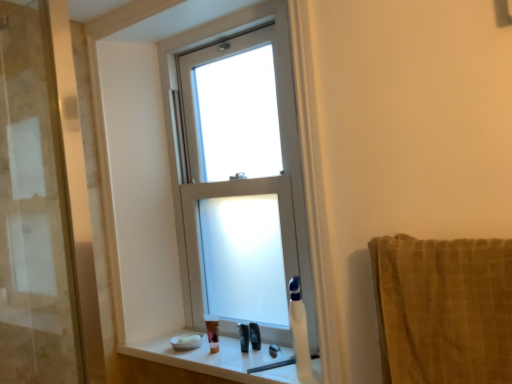
At what (x,y) coordinates should I click in order to perform the action: click on translucent plastic soap at lower center, the 3th toiletry in the right-to-left sequence. Please return your answer as a coordinate pair (x, y). This screenshot has width=512, height=384. Looking at the image, I should click on (212, 331).

Identify the location of white frosted glass window at center. Image resolution: width=512 pixels, height=384 pixels. (240, 184).

Measure the distance between point (243, 289) and camera.

Point (243, 289) is 5.55 feet from camera.

The height and width of the screenshot is (384, 512). Find the location of `brown textured towel at right`. brown textured towel at right is located at coordinates (443, 309).

Describe the element at coordinates (443, 309) in the screenshot. This screenshot has width=512, height=384. I see `brown textured towel at right` at that location.

This screenshot has width=512, height=384. Find the location of `white plastic window frame at center`. white plastic window frame at center is located at coordinates (172, 127).

This screenshot has height=384, width=512. What do you see at coordinates (255, 336) in the screenshot? I see `black plastic razor at lower center, marked as the 1th toiletry in a right-to-left arrangement` at bounding box center [255, 336].

Locate an element on the screen. Image resolution: width=512 pixels, height=384 pixels. white plastic soap dispenser at lower right is located at coordinates (298, 330).

Does white plastic soap dispenser at lower right have a lesser height compared to white frosted glass window at center?

Indeed, white plastic soap dispenser at lower right has a lesser height compared to white frosted glass window at center.

Considering the relative sizes of white plastic soap dispenser at lower right and white frosted glass window at center in the image provided, is white plastic soap dispenser at lower right wider than white frosted glass window at center?

Yes, white plastic soap dispenser at lower right is wider than white frosted glass window at center.

Does white plastic soap dispenser at lower right turn towards white frosted glass window at center?

No, white plastic soap dispenser at lower right is not turned towards white frosted glass window at center.

Where is `window behind the white plastic soap dispenser at lower right`? window behind the white plastic soap dispenser at lower right is located at coordinates (240, 184).

Which of these two, white glossy window sill at lower center or black plastic razor at lower center, which is the 3th toiletry in left-to-right order, stands taller?

black plastic razor at lower center, which is the 3th toiletry in left-to-right order.

Based on their sizes in the image, would you say white glossy window sill at lower center is bigger or smaller than black plastic razor at lower center, which is the 3th toiletry in left-to-right order?

Clearly, white glossy window sill at lower center is larger in size than black plastic razor at lower center, which is the 3th toiletry in left-to-right order.

Is there a large distance between translucent plastic soap at lower center, acting as the 1th toiletry starting from the left, and brown textured towel at right?

No.

Does point (208, 339) come behind point (499, 331)?

Yes.

Does translucent plastic soap at lower center, acting as the 1th toiletry starting from the left, turn towards brown textured towel at right?

No, translucent plastic soap at lower center, acting as the 1th toiletry starting from the left, is not aimed at brown textured towel at right.

Considering the relative sizes of translucent plastic soap at lower center, the 3th toiletry in the right-to-left sequence, and brown textured towel at right in the image provided, is translucent plastic soap at lower center, the 3th toiletry in the right-to-left sequence, wider than brown textured towel at right?

No.

Which object is more forward, black plastic razor at lower center, which is the 3th toiletry in left-to-right order, or white frosted glass window at center?

white frosted glass window at center.

What's the angular difference between black plastic razor at lower center, which is the 3th toiletry in left-to-right order, and white frosted glass window at center's facing directions?

black plastic razor at lower center, which is the 3th toiletry in left-to-right order, and white frosted glass window at center are facing 15.9 degrees away from each other.

Is black plastic razor at lower center, which is the 3th toiletry in left-to-right order, not within white frosted glass window at center?

Yes, black plastic razor at lower center, which is the 3th toiletry in left-to-right order, is outside of white frosted glass window at center.

Which is more to the right, black plastic razor at lower center, which is the 3th toiletry in left-to-right order, or white frosted glass window at center?

From the viewer's perspective, black plastic razor at lower center, which is the 3th toiletry in left-to-right order, appears more on the right side.

Considering the sizes of white frosted glass window at center and black plastic razor at lower center, which is the 3th toiletry in left-to-right order, in the image, is white frosted glass window at center wider or thinner than black plastic razor at lower center, which is the 3th toiletry in left-to-right order,?

Considering their sizes, white frosted glass window at center looks broader than black plastic razor at lower center, which is the 3th toiletry in left-to-right order.

Choose the correct answer: Is white frosted glass window at center inside black plastic razor at lower center, which is the 3th toiletry in left-to-right order, or outside it?

The correct answer is: outside.

From the image's perspective, is white frosted glass window at center under black plastic razor at lower center, marked as the 1th toiletry in a right-to-left arrangement?

No.

In the image, is white frosted glass window at center positioned in front of or behind black plastic razor at lower center, marked as the 1th toiletry in a right-to-left arrangement?

In the image, white frosted glass window at center appears in front of black plastic razor at lower center, marked as the 1th toiletry in a right-to-left arrangement.

Can you confirm if white frosted glass window at center is thinner than white plastic soap dispenser at lower right?

Indeed, white frosted glass window at center has a lesser width compared to white plastic soap dispenser at lower right.

This screenshot has width=512, height=384. Find the location of `window behind the white plastic soap dispenser at lower right`. window behind the white plastic soap dispenser at lower right is located at coordinates (240, 184).

From the image's perspective, is white frosted glass window at center above white plastic soap dispenser at lower right?

Indeed, from the image's perspective, white frosted glass window at center is shown above white plastic soap dispenser at lower right.

Does white frosted glass window at center come behind white plastic soap dispenser at lower right?

Yes, white frosted glass window at center is behind white plastic soap dispenser at lower right.

Is white glossy window sill at lower center shorter than white plastic soap dispenser at lower right?

Correct, white glossy window sill at lower center is not as tall as white plastic soap dispenser at lower right.

Between white glossy window sill at lower center and white plastic soap dispenser at lower right, which one appears on the left side from the viewer's perspective?

white glossy window sill at lower center.

From the image's perspective, is white glossy window sill at lower center located beneath white plastic soap dispenser at lower right?

Yes.

In terms of width, does white glossy window sill at lower center look wider or thinner when compared to white plastic soap dispenser at lower right?

white glossy window sill at lower center is wider than white plastic soap dispenser at lower right.

There is a white plastic soap dispenser at lower right. At what (x,y) coordinates should I click in order to perform the action: click on window above it (from a real-world perspective). Please return your answer as a coordinate pair (x, y). This screenshot has height=384, width=512. Looking at the image, I should click on (240, 184).

Which toiletry is the 2nd one when counting from the right side of the white glossy window sill at lower center? Please provide its 2D coordinates.

[(255, 336)]

Looking at the image, which one is located further to translucent plastic soap at lower center, the 3th toiletry in the right-to-left sequence, white glossy window sill at lower center or white plastic window frame at center?

Among the two, white plastic window frame at center is located further to translucent plastic soap at lower center, the 3th toiletry in the right-to-left sequence.

Which object lies nearer to the anchor point white frosted glass window at center, white plastic soap dispenser at lower right or translucent plastic soap at lower center, acting as the 1th toiletry starting from the left?

Among the two, white plastic soap dispenser at lower right is located nearer to white frosted glass window at center.

Based on their spatial positions, is translucent plastic toothbrush at lower center, which is the second toiletry in right-to-left order, or white plastic soap dispenser at lower right closer to black plastic razor at lower center, which is the 3th toiletry in left-to-right order?

translucent plastic toothbrush at lower center, which is the second toiletry in right-to-left order, is positioned closer to the anchor black plastic razor at lower center, which is the 3th toiletry in left-to-right order.

When comparing their distances from black plastic razor at lower center, marked as the 1th toiletry in a right-to-left arrangement, does translucent plastic soap at lower center, acting as the 1th toiletry starting from the left, or white plastic window frame at center seem closer?

Based on the image, translucent plastic soap at lower center, acting as the 1th toiletry starting from the left, appears to be nearer to black plastic razor at lower center, marked as the 1th toiletry in a right-to-left arrangement.

From the image, which object appears to be nearer to translucent plastic soap at lower center, acting as the 1th toiletry starting from the left, black plastic razor at lower center, which is the 3th toiletry in left-to-right order, or white glossy window sill at lower center?

Based on the image, white glossy window sill at lower center appears to be nearer to translucent plastic soap at lower center, acting as the 1th toiletry starting from the left.

Which object lies nearer to the anchor point brown textured towel at right, white plastic soap dispenser at lower right or white frosted glass window at center?

white plastic soap dispenser at lower right.

Looking at the image, which one is located further to translucent plastic soap at lower center, the 3th toiletry in the right-to-left sequence, white plastic soap dispenser at lower right or white glossy window sill at lower center?

white plastic soap dispenser at lower right.

When comparing their distances from white glossy window sill at lower center, does white plastic window frame at center or translucent plastic toothbrush at lower center, the second toiletry in the left-to-right sequence, seem closer?

Based on the image, translucent plastic toothbrush at lower center, the second toiletry in the left-to-right sequence, appears to be nearer to white glossy window sill at lower center.

Where is `soap dispenser between white plastic window frame at center and translucent plastic toothbrush at lower center, the second toiletry in the left-to-right sequence, in the vertical direction`? The width and height of the screenshot is (512, 384). soap dispenser between white plastic window frame at center and translucent plastic toothbrush at lower center, the second toiletry in the left-to-right sequence, in the vertical direction is located at coordinates (298, 330).

The height and width of the screenshot is (384, 512). In order to click on window between white plastic window frame at center and white plastic soap dispenser at lower right in the vertical direction in this screenshot , I will do `click(240, 184)`.

Image resolution: width=512 pixels, height=384 pixels. I want to click on soap dispenser that lies between white plastic window frame at center and white glossy window sill at lower center from top to bottom, so click(298, 330).

I want to click on soap dispenser positioned between brown textured towel at right and translucent plastic toothbrush at lower center, the second toiletry in the left-to-right sequence, from near to far, so click(x=298, y=330).